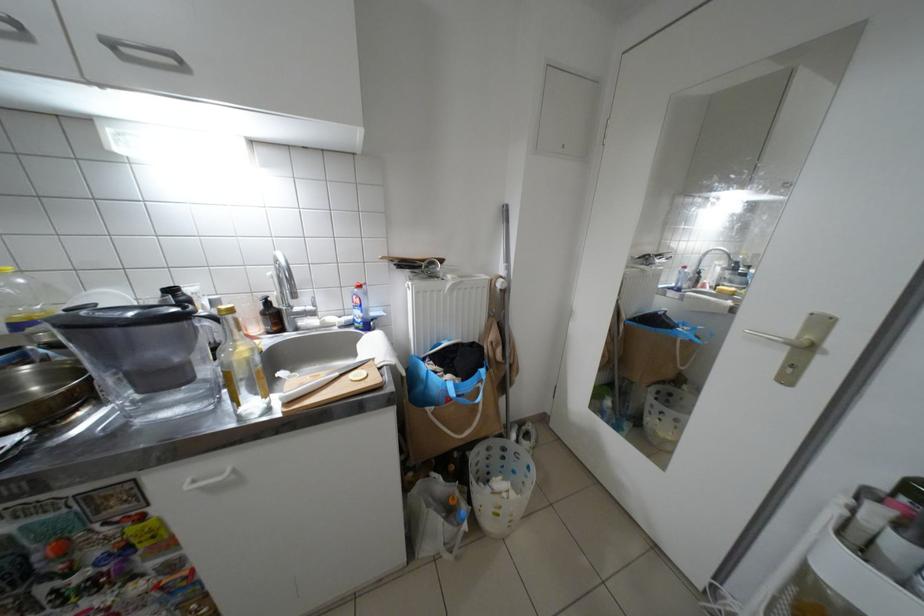
Locate an element on the screen. soap dispenser pump is located at coordinates (272, 294).